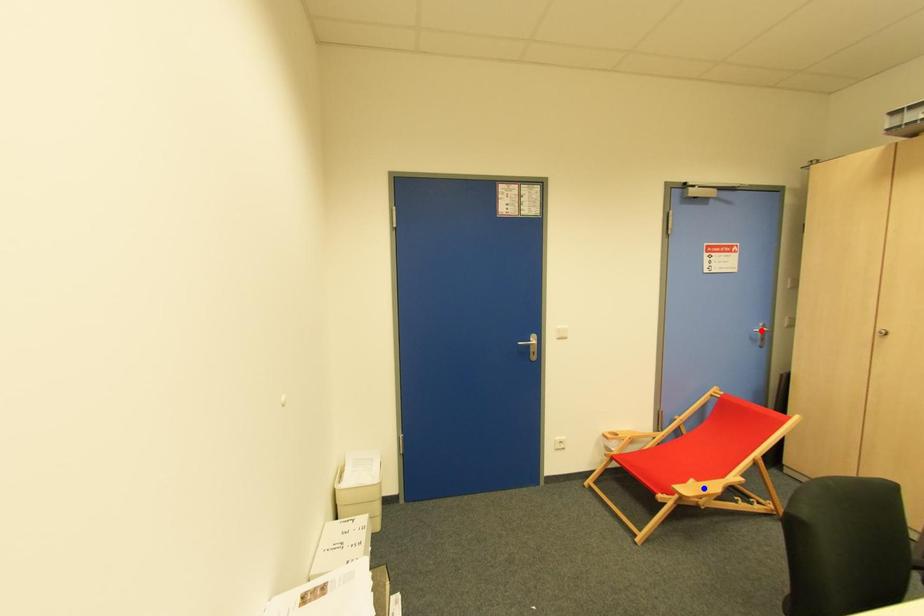
Question: Two points are marked on the image. Which point is closer to the camera?

Choices:
 (A) Blue point is closer.
 (B) Red point is closer.

Answer: (A)